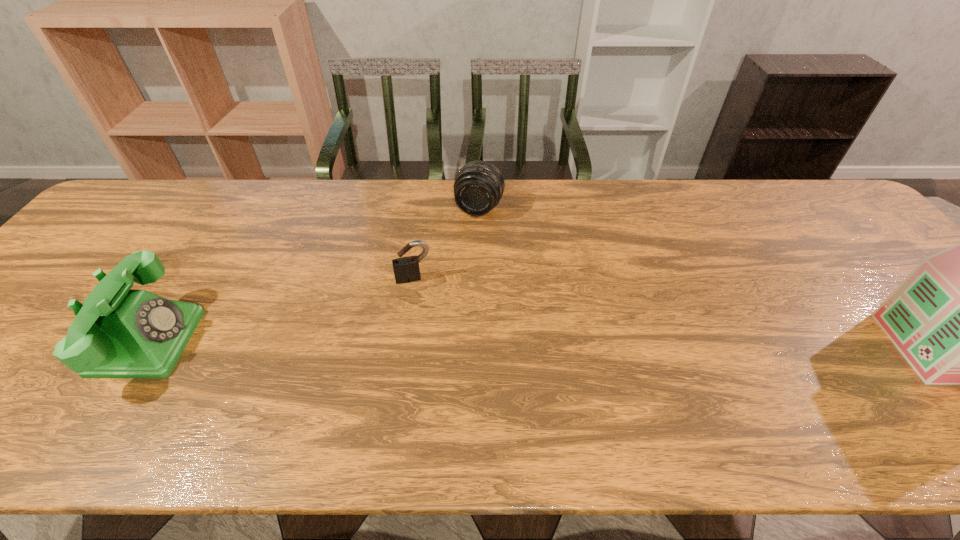
Where is `the leftmost object`? This screenshot has height=540, width=960. the leftmost object is located at coordinates (117, 333).

In order to click on telephone in this screenshot , I will do (117, 333).

At what (x,y) coordinates should I click in order to perform the action: click on padlock. Please return your answer as a coordinate pair (x, y). Looking at the image, I should click on (406, 269).

At what (x,y) coordinates should I click in order to perform the action: click on the shortest object. Please return your answer as a coordinate pair (x, y). Looking at the image, I should click on (406, 269).

Locate an element on the screen. the second object from right to left is located at coordinates (479, 186).

Locate an element on the screen. The image size is (960, 540). the farthest object is located at coordinates (479, 186).

At what (x,y) coordinates should I click in order to perform the action: click on free spot located on the dial of the second tallest object. Please return your answer as a coordinate pair (x, y). Looking at the image, I should click on click(x=260, y=341).

Image resolution: width=960 pixels, height=540 pixels. What are the coordinates of `vacant space located with the keyhole on the front of the padlock` in the screenshot? It's located at (423, 316).

Locate an element on the screen. blank space located 0.070m with the keyhole on the front of the padlock is located at coordinates (420, 304).

At what (x,y) coordinates should I click in order to perform the action: click on vacant point located 0.100m with the keyhole on the front of the padlock. Please return your answer as a coordinate pair (x, y). Looking at the image, I should click on (422, 313).